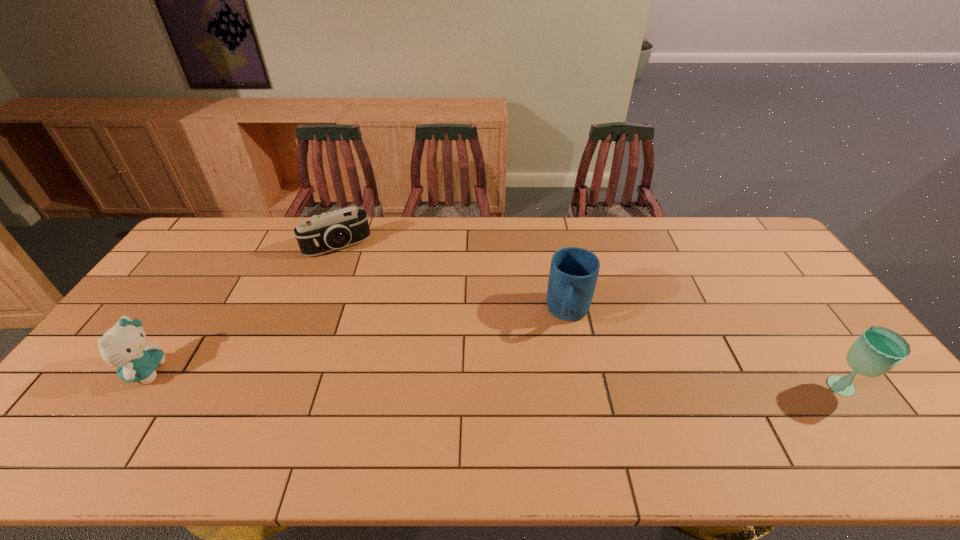
Where is `the leftmost object`? The image size is (960, 540). the leftmost object is located at coordinates (123, 346).

Where is `the rightmost object`? Image resolution: width=960 pixels, height=540 pixels. the rightmost object is located at coordinates (878, 350).

Find the location of a particular element. This screenshot has height=540, width=960. the farthest object is located at coordinates (327, 232).

Find the location of a particular element. This screenshot has height=540, width=960. the third object from right to left is located at coordinates (327, 232).

This screenshot has width=960, height=540. Find the location of `the third object from left to right`. the third object from left to right is located at coordinates (573, 274).

At what (x,y) coordinates should I click in order to perform the action: click on the second farthest object. Please return your answer as a coordinate pair (x, y). The width and height of the screenshot is (960, 540). Looking at the image, I should click on (573, 274).

I want to click on vacant region located 0.210m on the face of the kitten, so click(245, 371).

Locate an element on the screen. This screenshot has height=540, width=960. vacant space located 0.200m on the left of the glass is located at coordinates (747, 389).

Where is `vacant position located on the front lens of the camera`? This screenshot has height=540, width=960. vacant position located on the front lens of the camera is located at coordinates (369, 298).

The width and height of the screenshot is (960, 540). I want to click on free space located on the front lens of the camera, so click(381, 321).